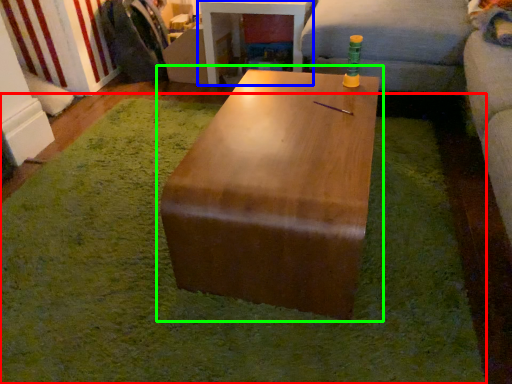
Question: Which object is the farthest from mat (highlighted by a red box)? Choose among these: table (highlighted by a blue box) or table (highlighted by a green box).

Choices:
 (A) table
 (B) table

Answer: (A)